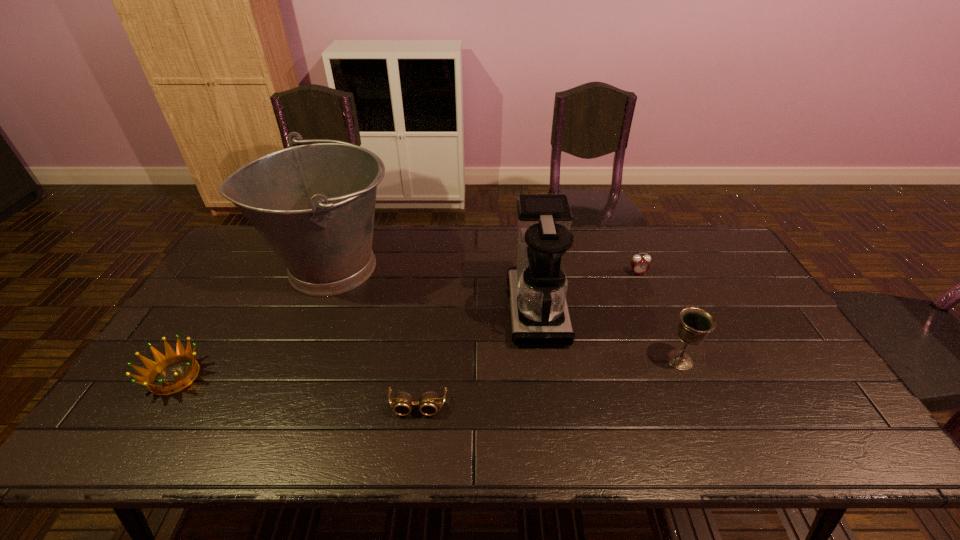
Where is `vacant area that lies between the alarm clock and the bucket`? This screenshot has height=540, width=960. vacant area that lies between the alarm clock and the bucket is located at coordinates (485, 270).

Locate an element on the screen. The image size is (960, 540). vacant area that lies between the crown and the third object from left to right is located at coordinates (x=297, y=392).

Where is `free spot between the tallest object and the third tallest object`? Image resolution: width=960 pixels, height=540 pixels. free spot between the tallest object and the third tallest object is located at coordinates (506, 313).

Locate an element on the screen. This screenshot has width=960, height=540. vacant space that is in between the tallest object and the chalice is located at coordinates (506, 313).

Image resolution: width=960 pixels, height=540 pixels. What are the coordinates of `object that ranks as the third closest to the alarm clock` in the screenshot? It's located at pos(428,402).

Point out which object is positioned as the nearest to the alarm clock. Please provide its 2D coordinates. Your answer should be formatted as a tuple, i.e. [(x, y)], where the tuple contains the x and y coordinates of a point satisfying the conditions above.

[(537, 287)]

This screenshot has height=540, width=960. Find the location of `free space that satisfies the following two spatial constraints: 1. at the front of the second tallest object where the controls are located; 2. through the lenses of the goggles`. free space that satisfies the following two spatial constraints: 1. at the front of the second tallest object where the controls are located; 2. through the lenses of the goggles is located at coordinates (549, 407).

The height and width of the screenshot is (540, 960). I want to click on free space in the image that satisfies the following two spatial constraints: 1. at the front of the coffee maker where the controls are located; 2. on the front side of the crown, so click(x=545, y=377).

Identify the location of free location that satisfies the following two spatial constraints: 1. at the front of the fourth object from left to right where the controls are located; 2. on the right side of the third tallest object. (543, 360).

This screenshot has width=960, height=540. In order to click on free spot that satisfies the following two spatial constraints: 1. on the clock face of the alarm clock; 2. at the front of the coffee maker where the controls are located in this screenshot , I will do `click(653, 310)`.